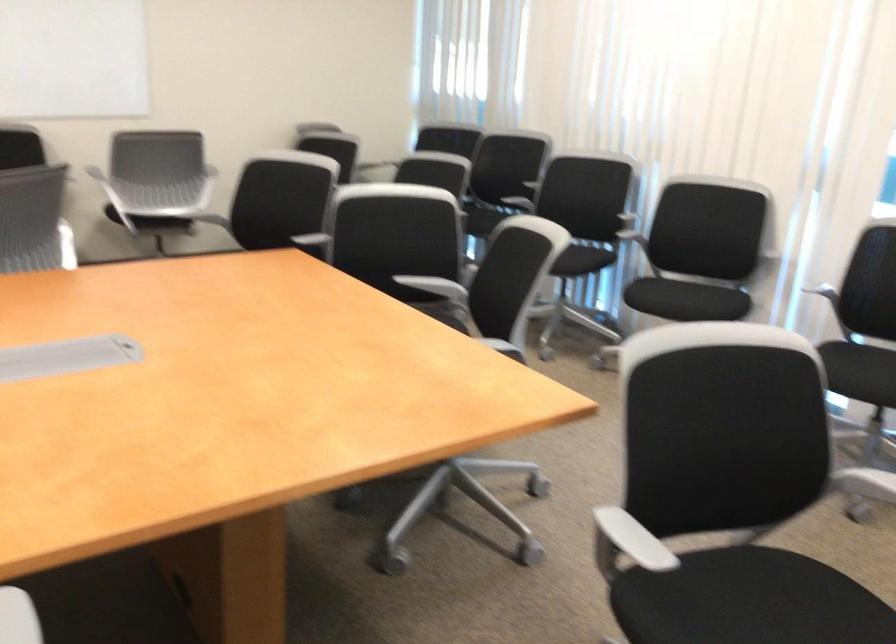
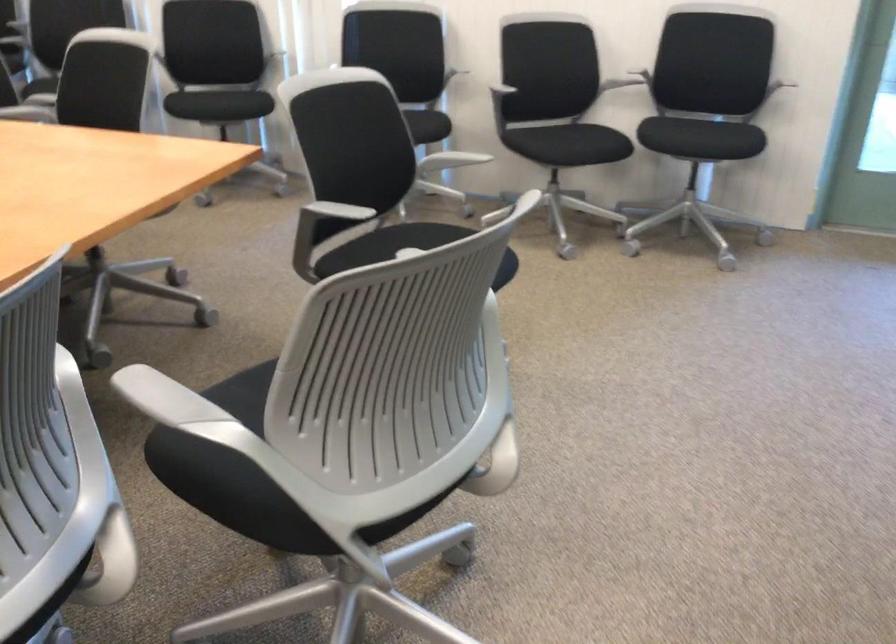
In the second image, find the point that corresponds to pixel 704 305 in the first image.

(238, 102)